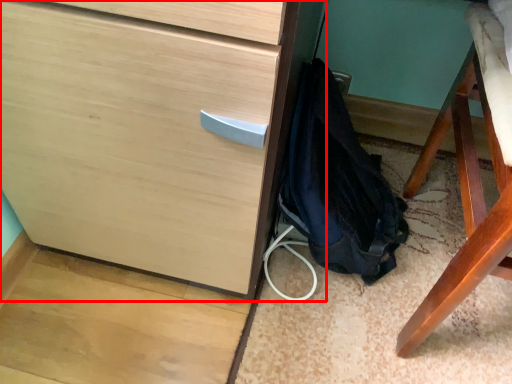
Question: From the image's perspective, what is the correct spatial positioning of chest of drawers (annotated by the red box) in reference to backpack?

Choices:
 (A) above
 (B) below

Answer: (A)